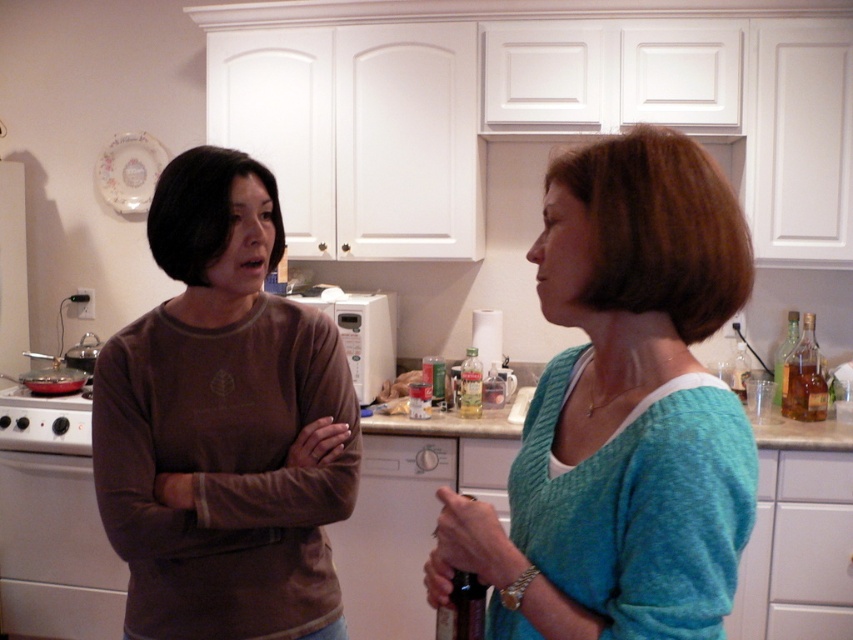
Is teal knitted sweater at center bigger than brown matte shirt at left?

Correct, teal knitted sweater at center is larger in size than brown matte shirt at left.

Who is more distant from viewer, [579,168] or [167,250]?

Positioned behind is point [167,250].

Which is in front, point (701, 180) or point (154, 424)?

Point (701, 180) is more forward.

Identify the location of teal knitted sweater at center. The width and height of the screenshot is (853, 640). pos(622,412).